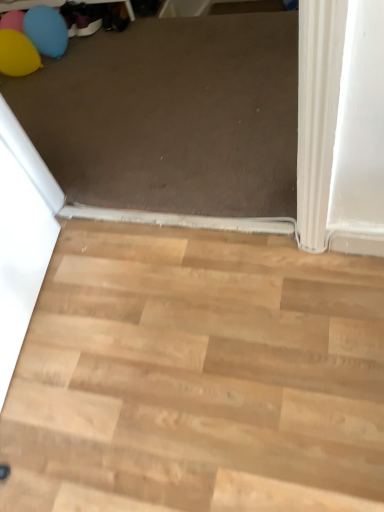
Locate an element on the screen. The width and height of the screenshot is (384, 512). rubber balloon at upper left is located at coordinates (32, 41).

This screenshot has width=384, height=512. What do you see at coordinates (32, 41) in the screenshot? I see `rubber balloon at upper left` at bounding box center [32, 41].

Identify the location of light wood floor at lower right. The width and height of the screenshot is (384, 512). (197, 376).

Describe the element at coordinates (197, 376) in the screenshot. I see `light wood floor at lower right` at that location.

At what (x,y) coordinates should I click in order to perform the action: click on rubber balloon at upper left. Please return your answer as a coordinate pair (x, y). This screenshot has width=384, height=512. Looking at the image, I should click on (32, 41).

Would you say rubber balloon at upper left is to the left or to the right of light wood floor at lower right in the picture?

In the image, rubber balloon at upper left appears on the left side of light wood floor at lower right.

Which object is further away from the camera taking this photo, rubber balloon at upper left or light wood floor at lower right?

rubber balloon at upper left.

Which point is more forward, (39, 34) or (270, 394)?

The point (270, 394) is closer.

From the image's perspective, is rubber balloon at upper left on light wood floor at lower right?

Correct, rubber balloon at upper left appears higher than light wood floor at lower right in the image.

From a real-world perspective, is rubber balloon at upper left positioned over light wood floor at lower right based on gravity?

Yes, from a real-world perspective, rubber balloon at upper left is on top of light wood floor at lower right.

Looking at this image, which of these two, rubber balloon at upper left or light wood floor at lower right, is thinner?

With smaller width is rubber balloon at upper left.

Between rubber balloon at upper left and light wood floor at lower right, which one has less height?

With less height is light wood floor at lower right.

Between rubber balloon at upper left and light wood floor at lower right, which one has smaller size?

rubber balloon at upper left.

Is light wood floor at lower right surrounded by rubber balloon at upper left?

Definitely not — light wood floor at lower right is not inside rubber balloon at upper left.

Are rubber balloon at upper left and light wood floor at lower right located far from each other?

Yes, rubber balloon at upper left is far from light wood floor at lower right.

Could you tell me if rubber balloon at upper left is turned towards light wood floor at lower right?

No, rubber balloon at upper left is not turned towards light wood floor at lower right.

Measure the distance from rubber balloon at upper left to light wood floor at lower right.

rubber balloon at upper left and light wood floor at lower right are 1.57 meters apart.

Find the location of a particular element. The width and height of the screenshot is (384, 512). balloon lying above the light wood floor at lower right (from the image's perspective) is located at coordinates tap(32, 41).

Is light wood floor at lower right at the right side of rubber balloon at upper left?

Yes.

Considering the positions of objects light wood floor at lower right and rubber balloon at upper left in the image provided, who is in front, light wood floor at lower right or rubber balloon at upper left?

light wood floor at lower right.

Between point (284, 425) and point (43, 10), which one is positioned in front?

The point (284, 425) is in front.

From the image's perspective, which one is positioned lower, light wood floor at lower right or rubber balloon at upper left?

light wood floor at lower right is shown below in the image.

From a real-world perspective, is light wood floor at lower right positioned above or below rubber balloon at upper left?

light wood floor at lower right is below rubber balloon at upper left.

Can you confirm if light wood floor at lower right is wider than rubber balloon at upper left?

Indeed, light wood floor at lower right has a greater width compared to rubber balloon at upper left.

In the scene shown: Who is taller, light wood floor at lower right or rubber balloon at upper left?

rubber balloon at upper left is taller.

Can you confirm if light wood floor at lower right is bigger than rubber balloon at upper left?

Correct, light wood floor at lower right is larger in size than rubber balloon at upper left.

Is light wood floor at lower right located outside rubber balloon at upper left?

light wood floor at lower right is positioned outside rubber balloon at upper left.

Is light wood floor at lower right in contact with rubber balloon at upper left?

No, light wood floor at lower right is not with rubber balloon at upper left.

Is rubber balloon at upper left at the back of light wood floor at lower right?

That's not correct — light wood floor at lower right is not looking away from rubber balloon at upper left.

Can you tell me how much light wood floor at lower right and rubber balloon at upper left differ in facing direction?

There is a 178-degree angle between the facing directions of light wood floor at lower right and rubber balloon at upper left.

This screenshot has width=384, height=512. Find the location of `balloon behind the light wood floor at lower right`. balloon behind the light wood floor at lower right is located at coordinates (32, 41).

Locate an element on the screen. stairwell that appears in front of the rubber balloon at upper left is located at coordinates (197, 376).

Locate an element on the screen. Image resolution: width=384 pixels, height=512 pixels. stairwell on the right of rubber balloon at upper left is located at coordinates (197, 376).